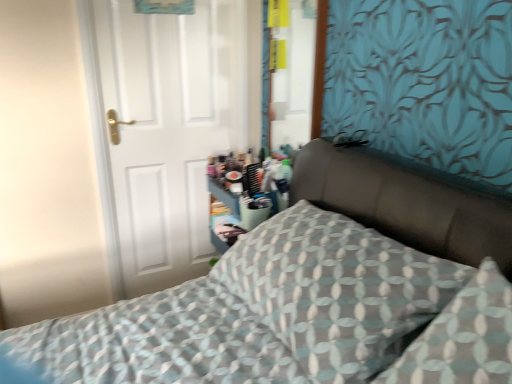
Question: Considering their positions, is white matte door at left located in front of or behind patterned fabric pillow at center?

Choices:
 (A) front
 (B) behind

Answer: (B)

Question: Is white matte door at left inside the boundaries of patterned fabric pillow at center, or outside?

Choices:
 (A) inside
 (B) outside

Answer: (B)

Question: Considering the real-world distances, which object is closest to the patterned fabric bed at center?

Choices:
 (A) white matte door at left
 (B) patterned fabric pillow at center

Answer: (B)

Question: Which of these objects is positioned closest to the white matte door at left?

Choices:
 (A) patterned fabric pillow at center
 (B) patterned fabric bed at center

Answer: (B)